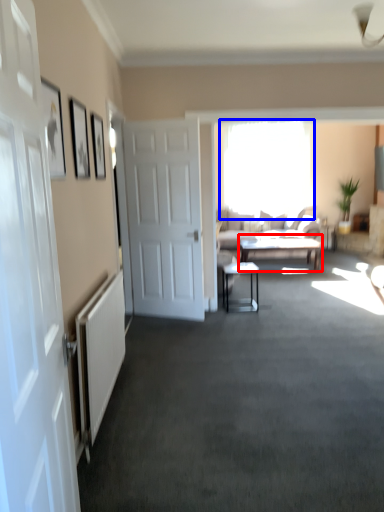
Question: Which object appears closest to the camera in this image, table (highlighted by a red box) or window (highlighted by a blue box)?

Choices:
 (A) table
 (B) window

Answer: (A)